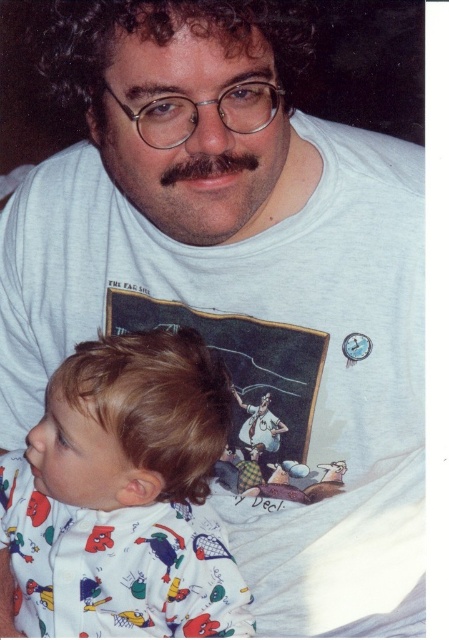
You are a photographer standing 1 meter away from the camera. You want to take a closeup shot of the white cotton onesie at lower left. Can you get a clear closeup without moving the camera or the subject?

The white cotton onesie at lower left is 73.69 centimeters away from camera. Since you are standing 1 meter away from the camera, the distance between you and the onesie is 1 meter minus 73.69 cm, which is 26.31 centimeters. This distance is too close for most cameras to focus properly, so you might not get a clear closeup without moving the camera or the subject.

You are standing in front of the image and want to determine which of the two points, point (64, 426) or point (254, 204), is closer to you. Based on the scene, which point is nearer?

Point (64, 426) is closer to you because it is further to the viewer than point (254, 204).

You are a photographer setting up for a family portrait. You need to ensure the white cotton onesie at lower left and the dark brown hair at center are both in focus. Given that your camera has a depth of field that can cover objects within a 10 inch range, will both items be in focus?

The white cotton onesie at lower left is 12.92 inches away from the dark brown hair at center. Since the distance between them exceeds the camera depth of field range of 10 inches, they cannot both be in focus at the same time.